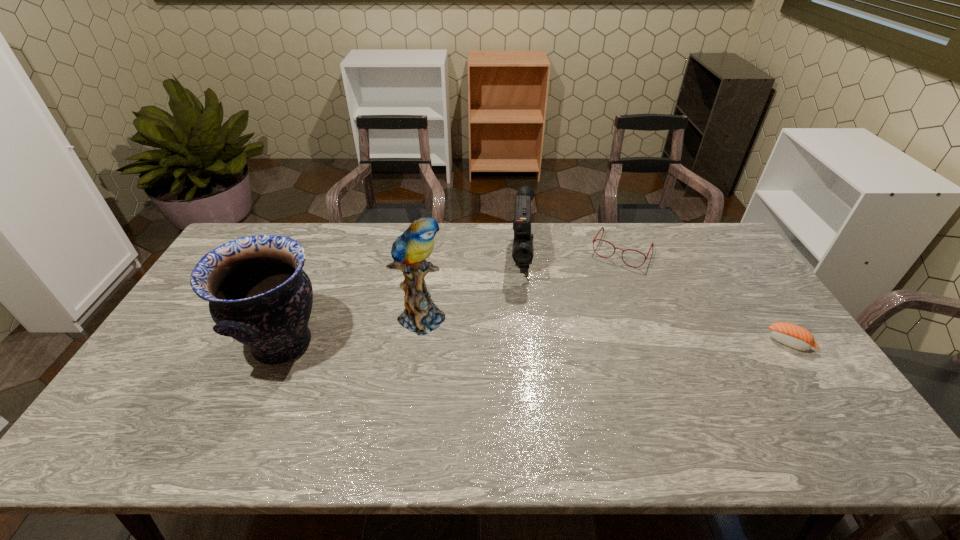
What are the coordinates of `free space between the fourth shortest object and the second object from right to left` in the screenshot? It's located at (452, 297).

Locate an element on the screen. Image resolution: width=960 pixels, height=540 pixels. free space that is in between the pottery and the third object from right to left is located at coordinates (402, 301).

Locate which object is the second closest to the parrot. Please provide its 2D coordinates. Your answer should be formatted as a tuple, i.e. [(x, y)], where the tuple contains the x and y coordinates of a point satisfying the conditions above.

[(522, 251)]

Select which object is the third closest to the pottery. Please provide its 2D coordinates. Your answer should be formatted as a tuple, i.e. [(x, y)], where the tuple contains the x and y coordinates of a point satisfying the conditions above.

[(594, 239)]

In order to click on free location that satisfies the following two spatial constraints: 1. on the front side of the rightmost object; 2. on the left side of the spectacles in this screenshot , I will do `click(659, 342)`.

The image size is (960, 540). Find the location of `free location that satisfies the following two spatial constraints: 1. on the front side of the fourth object from right to left; 2. on the left side of the rightmost object`. free location that satisfies the following two spatial constraints: 1. on the front side of the fourth object from right to left; 2. on the left side of the rightmost object is located at coordinates (420, 342).